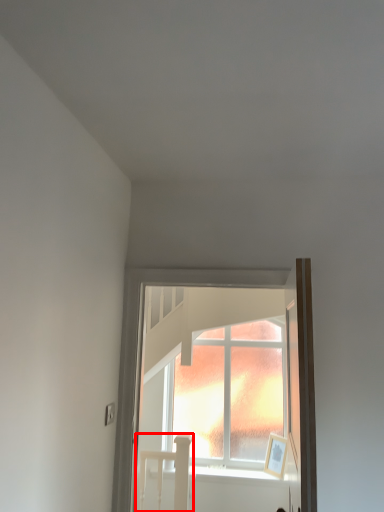
Question: In this image, where is bed (annotated by the red box) located relative to window?

Choices:
 (A) right
 (B) left

Answer: (B)